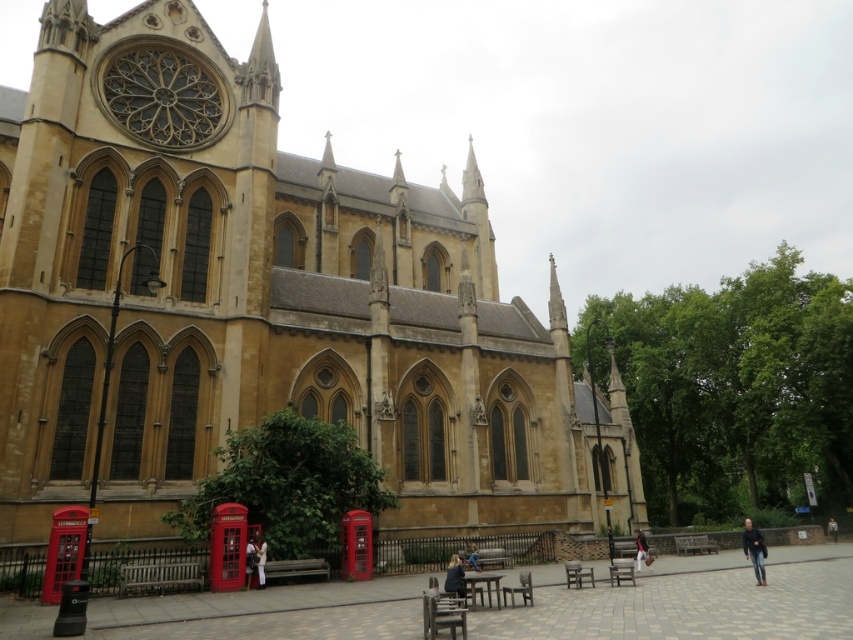
Question: Which object appears farthest from the camera in this image?

Choices:
 (A) light brown wooden bench at lower center
 (B) golden stone church at center
 (C) dark blue jeans at lower right
 (D) dark blue fabric jacket at center

Answer: (A)

Question: Which point is closer to the camera?

Choices:
 (A) (88, 320)
 (B) (761, 538)

Answer: (B)

Question: Is dark blue jeans at lower right in front of blue denim jeans at lower center?

Choices:
 (A) yes
 (B) no

Answer: (A)

Question: Can you confirm if golden stone church at center is smaller than dark blue jeans at lower right?

Choices:
 (A) yes
 (B) no

Answer: (B)

Question: Can you confirm if blue denim jeans at lower center is bigger than dark gray fabric jacket at lower right?

Choices:
 (A) yes
 (B) no

Answer: (B)

Question: Which point appears farthest from the camera in this image?

Choices:
 (A) (645, 552)
 (B) (450, 564)
 (C) (473, 561)

Answer: (B)